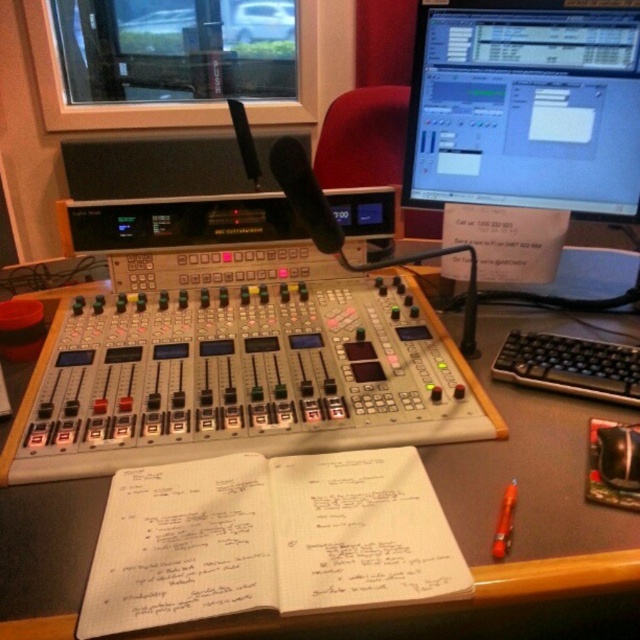
Is black plastic table at center positioned behind black plastic keyboard at center-right?

No, it is in front of black plastic keyboard at center-right.

Consider the image. Does black plastic table at center have a smaller size compared to black plastic keyboard at center-right?

Incorrect, black plastic table at center is not smaller in size than black plastic keyboard at center-right.

The height and width of the screenshot is (640, 640). I want to click on black plastic table at center, so click(x=499, y=504).

Who is shorter, black plastic table at center or white paper notebook at center?

Standing shorter between the two is white paper notebook at center.

Which of these two, black plastic table at center or white paper notebook at center, stands taller?

black plastic table at center is taller.

Where is `black plastic table at center`? The image size is (640, 640). black plastic table at center is located at coordinates (499, 504).

Is white paper notebook at center behind black plastic keyboard at center-right?

No, it is in front of black plastic keyboard at center-right.

Does white paper notebook at center have a smaller size compared to black plastic keyboard at center-right?

No, white paper notebook at center is not smaller than black plastic keyboard at center-right.

Identify the location of white paper notebook at center. (268, 540).